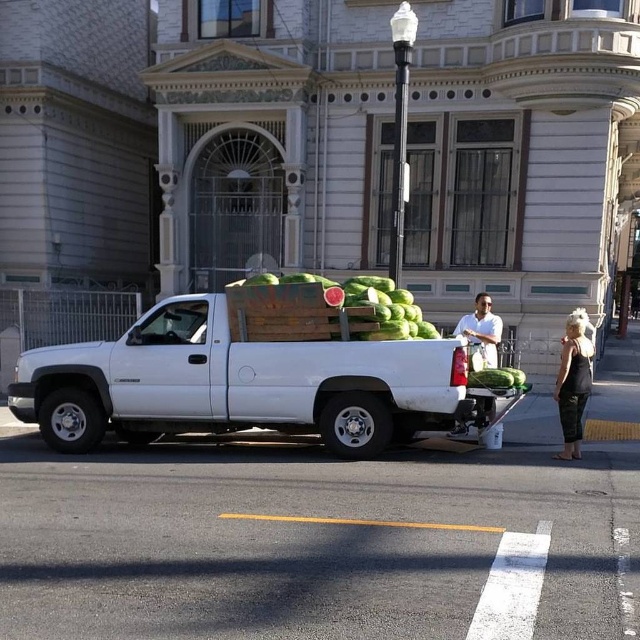
You are standing at the point marked by the coordinates point (321,308) in the image. What object are you directly facing?

The point (321,308) marks green matte watermelons at center, so you are directly facing the green matte watermelons at center.

You are a delivery driver who needs to park your truck exactly at the coordinates given in the scene. What are the coordinates where the white matte truck at center is parked?

The white matte truck at center is parked at coordinates point (237, 384).

You are a customer looking to buy a watermelon. You see the green matte watermelons at center and the black fabric dress at right. Which object is closer to you?

The green matte watermelons at center are closer to you because they are in front of the black fabric dress at right.